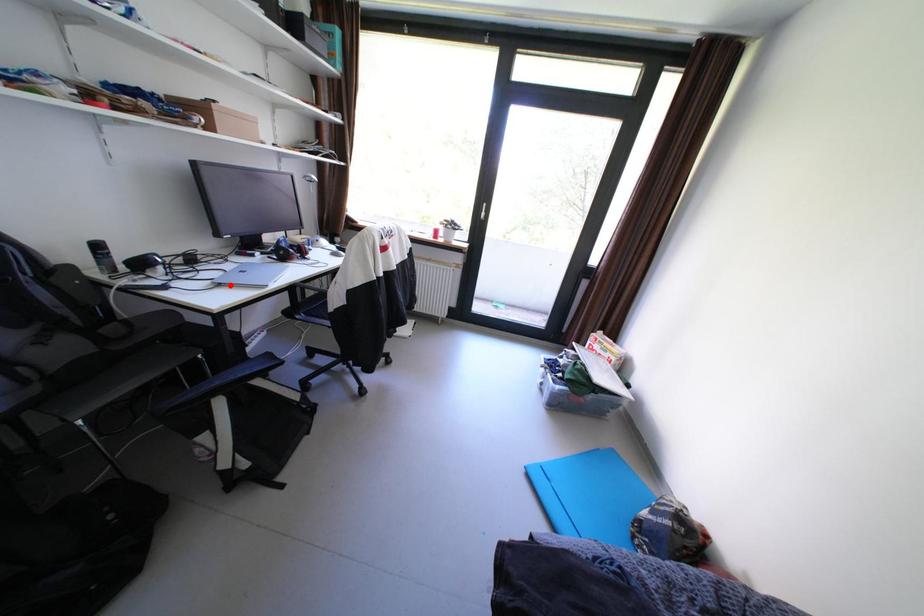
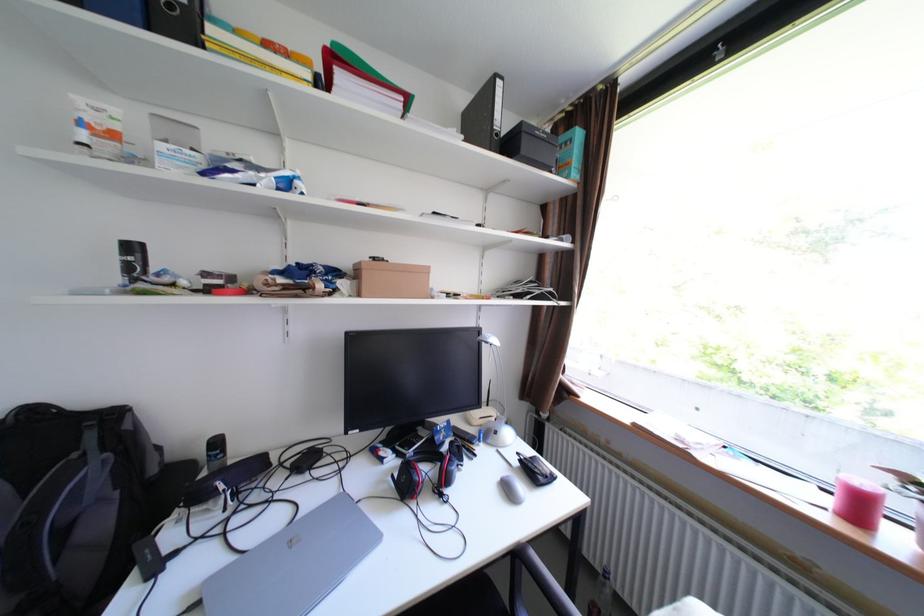
Find the pixel in the second image that matches the highlighted location in the first image.

(208, 604)